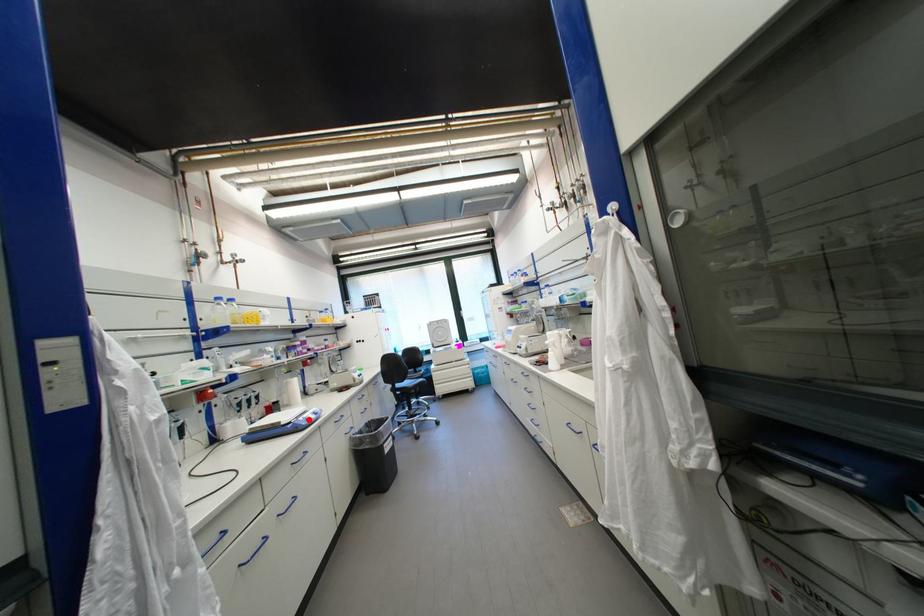
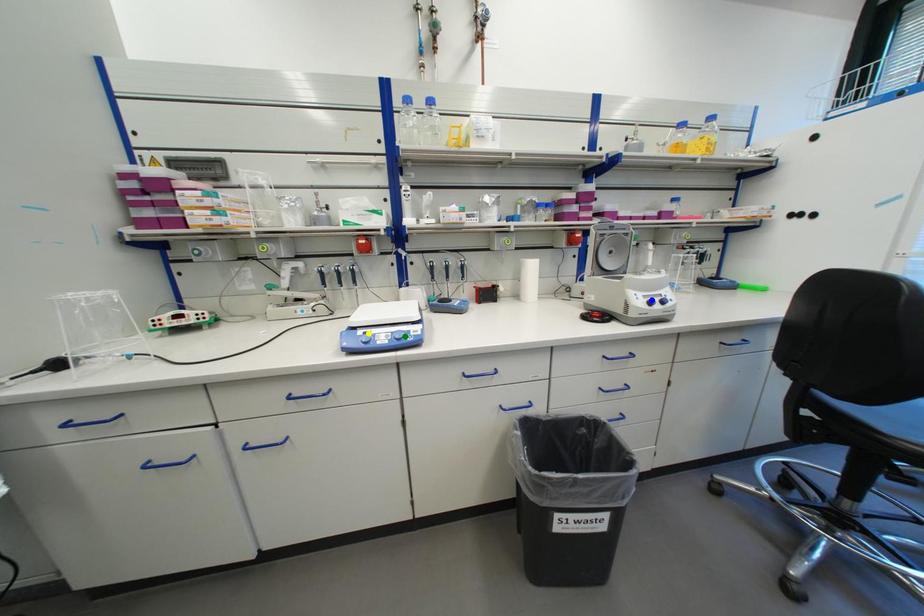
Question: I am providing you with two images of the same scene from different viewpoints. A red point is marked on the first image. You are given multiple points on the second image. Which point in image 2 is actually the same real-world point as the red point in image 1?

Choices:
 (A) blue point
 (B) yellow point
 (C) green point

Answer: (B)